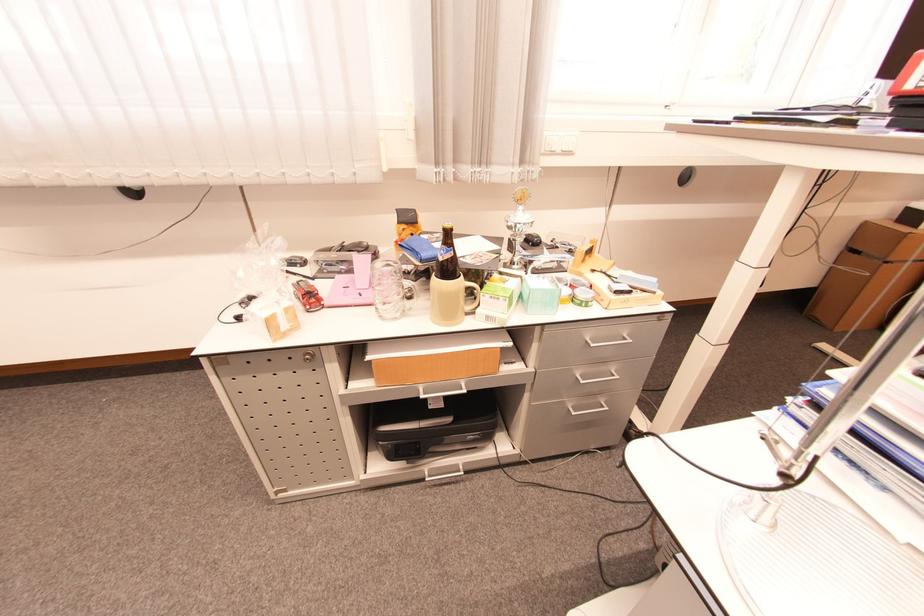
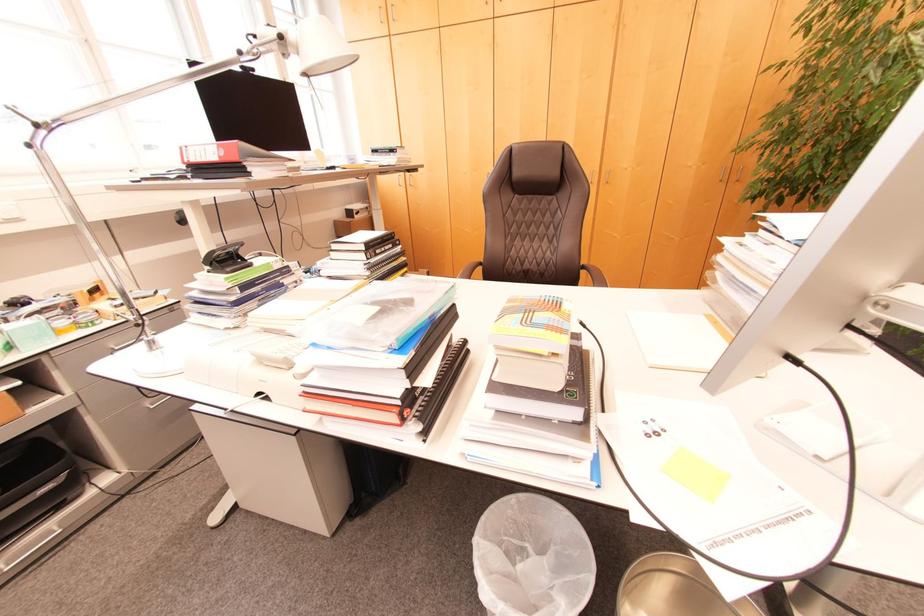
Question: Based on the continuous images, in which direction is the camera rotating? Reply with the corresponding letter.

Choices:
 (A) Left
 (B) Right
 (C) Up
 (D) Down

Answer: (B)